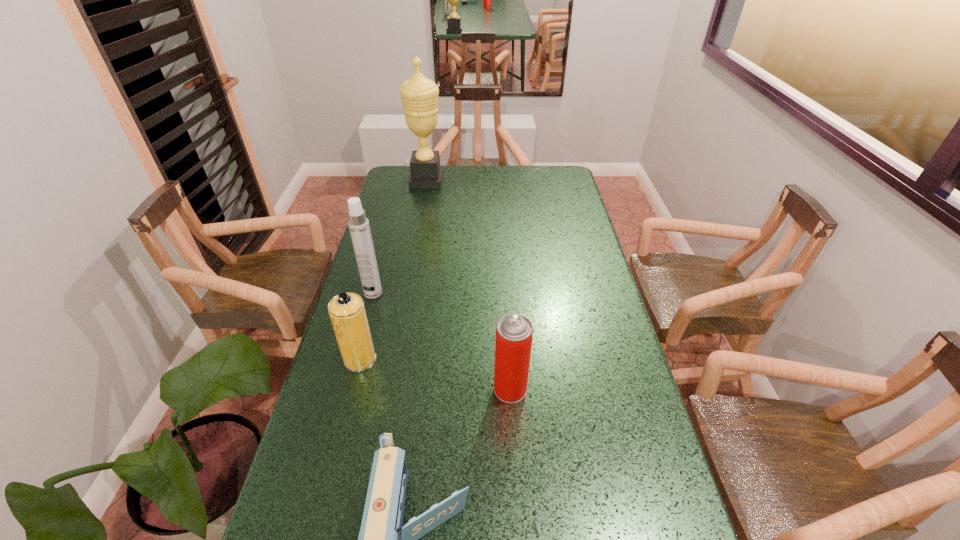
In order to click on vacant point located 0.270m on the right of the third farthest object in this screenshot , I will do pyautogui.click(x=470, y=359).

I want to click on object at the far edge, so click(419, 95).

Where is `trophy cup that is at the left edge`? trophy cup that is at the left edge is located at coordinates tap(419, 95).

Locate an element on the screen. Image resolution: width=960 pixels, height=540 pixels. object present at the far left corner is located at coordinates (419, 95).

Find the location of a particular element. free space at the left edge is located at coordinates (372, 433).

You are a GUI agent. You are given a task and a screenshot of the screen. Output one action in this format:
    pyautogui.click(x=<x>, y=<y>)
    Task: Click on the free point at the right edge
    The width and height of the screenshot is (960, 540).
    Given the screenshot: What is the action you would take?
    pyautogui.click(x=567, y=282)

At what (x,y) coordinates should I click in order to perform the action: click on empty space that is in between the second farthest aerosol can and the nearest aerosol can. Please return your answer as a coordinate pair (x, y). Image resolution: width=960 pixels, height=540 pixels. Looking at the image, I should click on (435, 374).

What are the coordinates of `free point between the second nearest object and the farthest object` in the screenshot? It's located at (468, 285).

Where is `vacant region between the tallest object and the fourth nearest object`? vacant region between the tallest object and the fourth nearest object is located at coordinates (400, 237).

Locate an element on the screen. The width and height of the screenshot is (960, 540). vacant point located between the second farthest aerosol can and the tallest object is located at coordinates (394, 269).